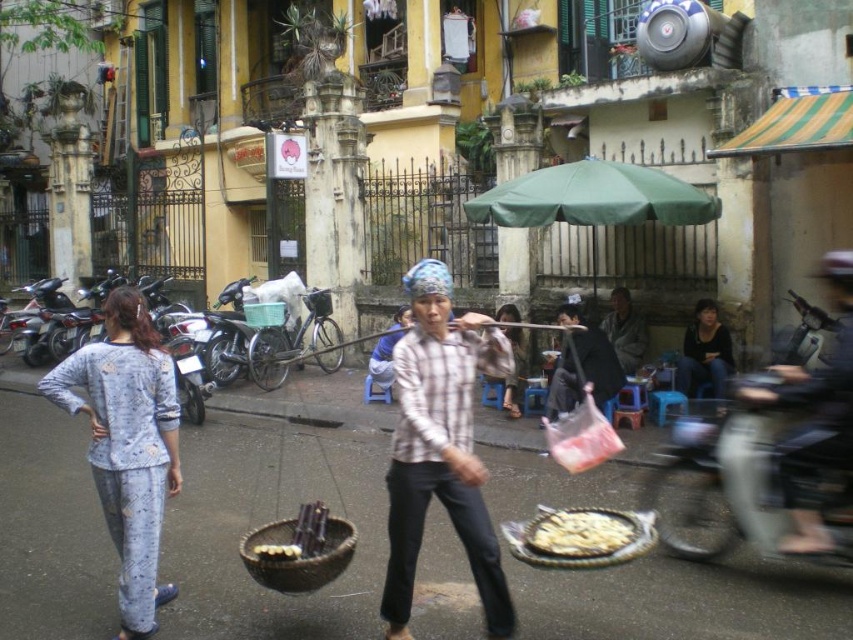
Between metallic silver scooter at right and gray woolen sweater at center, which one is positioned higher?

gray woolen sweater at center

In the scene shown: Does metallic silver scooter at right have a larger size compared to gray woolen sweater at center?

Yes, metallic silver scooter at right is bigger than gray woolen sweater at center.

The width and height of the screenshot is (853, 640). What are the coordinates of `metallic silver scooter at right` in the screenshot? It's located at (798, 444).

Which is in front, point (496, 208) or point (520, 339)?

Point (496, 208) is more forward.

The height and width of the screenshot is (640, 853). I want to click on green fabric umbrella at center, so click(593, 198).

Can you confirm if green fabric umbrella at center is wider than green woven basket at center?

Correct, the width of green fabric umbrella at center exceeds that of green woven basket at center.

Can you confirm if green fabric umbrella at center is positioned above green woven basket at center?

Yes.

Is point (595, 173) behind point (250, 326)?

No, (595, 173) is closer to viewer.

Locate an element on the screen. This screenshot has height=640, width=853. green fabric umbrella at center is located at coordinates (593, 198).